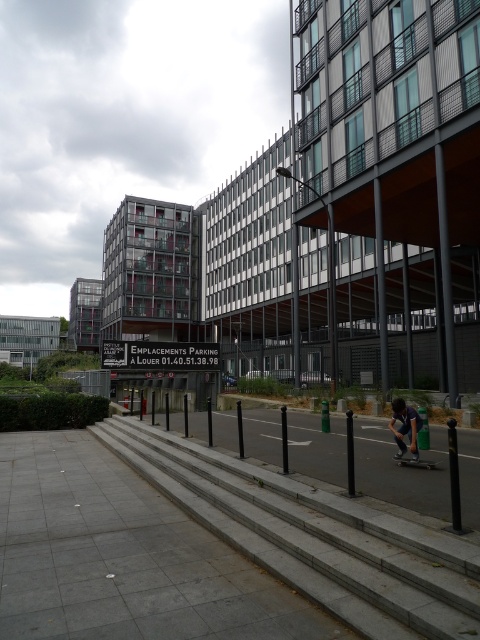
Does gray concrete stairs at center have a greater width compared to dark blue jeans at lower right?

Correct, the width of gray concrete stairs at center exceeds that of dark blue jeans at lower right.

Measure the distance between point (348, 573) and camera.

They are 13.42 feet apart.

The height and width of the screenshot is (640, 480). In order to click on gray concrete stairs at center in this screenshot , I will do `click(313, 538)`.

Who is more forward, [414,410] or [431,464]?

Point [414,410]

Between dark blue jeans at lower right and black smooth skateboard at lower right, which one appears on the right side from the viewer's perspective?

black smooth skateboard at lower right

You are a GUI agent. You are given a task and a screenshot of the screen. Output one action in this format:
    pyautogui.click(x=<x>, y=<y>)
    Task: Click on the dark blue jeans at lower right
    
    Given the screenshot: What is the action you would take?
    pyautogui.click(x=405, y=428)

Between gray concrete stairs at center and black smooth skateboard at lower right, which one appears on the right side from the viewer's perspective?

Positioned to the right is black smooth skateboard at lower right.

Can you confirm if gray concrete stairs at center is positioned to the left of black smooth skateboard at lower right?

Yes, gray concrete stairs at center is to the left of black smooth skateboard at lower right.

Is point (148, 433) positioned behind point (420, 461)?

That is True.

This screenshot has width=480, height=640. In order to click on gray concrete stairs at center in this screenshot , I will do pos(313,538).